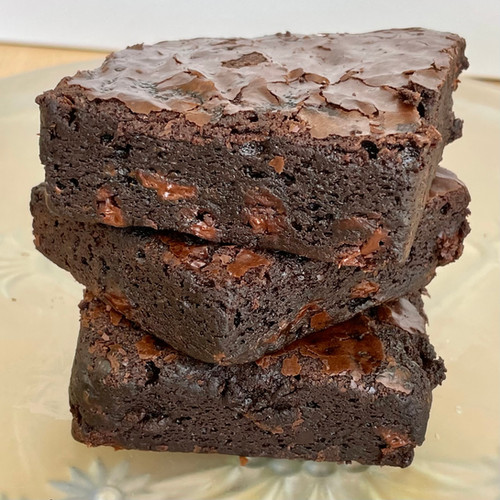
Where is `flower design`? This screenshot has width=500, height=500. flower design is located at coordinates (109, 492).